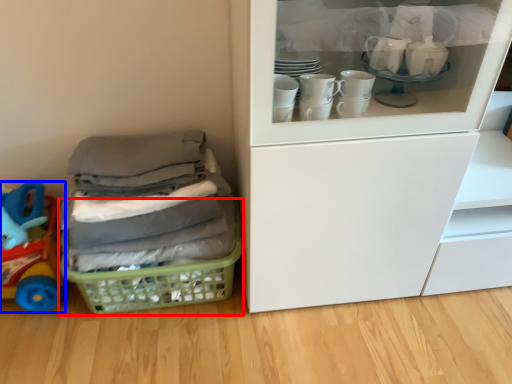
Question: Which object appears farthest to the camera in this image, basket (highlighted by a red box) or toy (highlighted by a blue box)?

Choices:
 (A) basket
 (B) toy

Answer: (A)